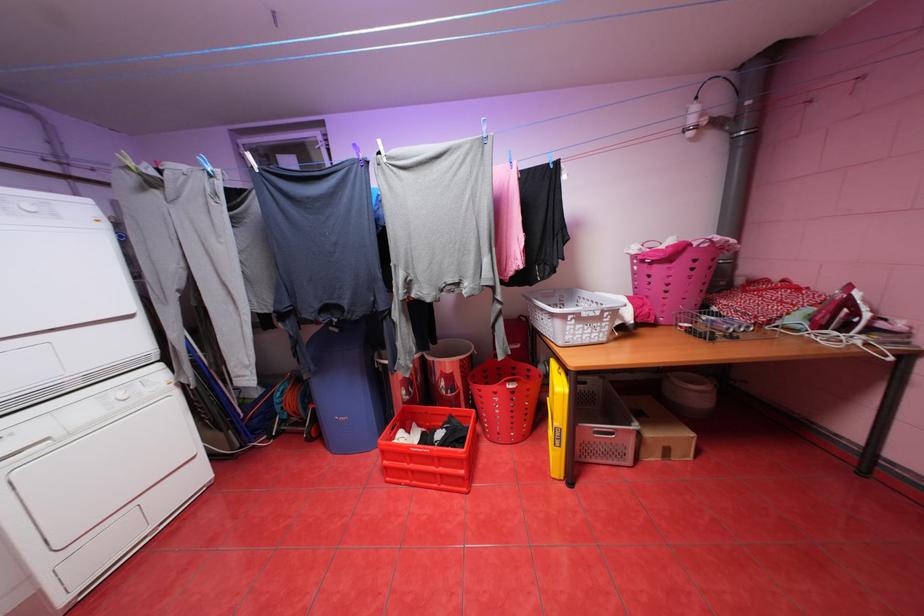
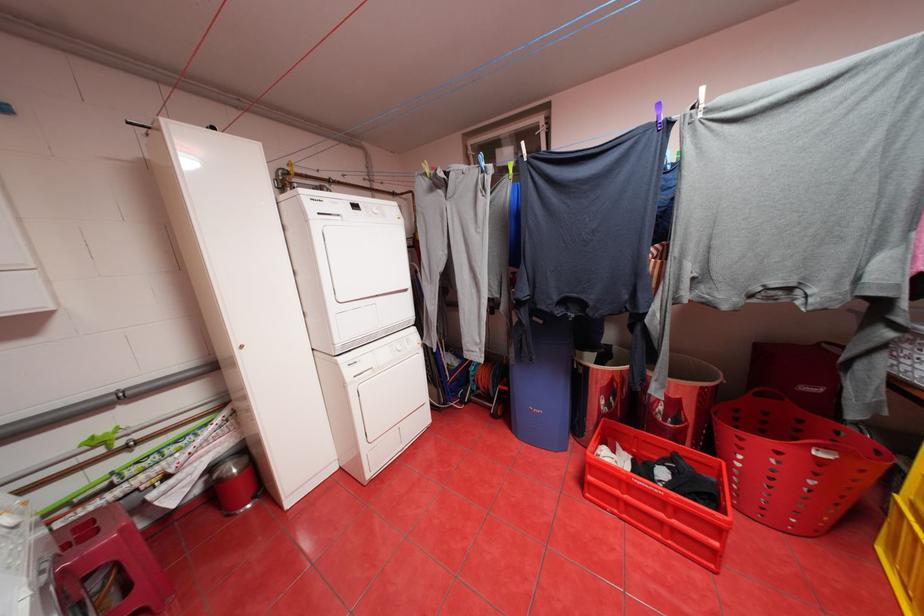
Find the pixel in the second image that matches point 428,424 in the first image.

(631, 448)